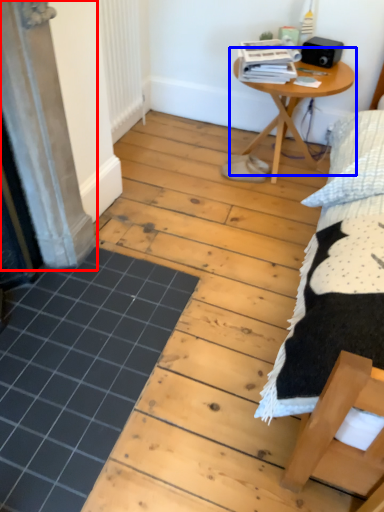
Question: Which object appears farthest to the camera in this image, screen door (highlighted by a red box) or table (highlighted by a blue box)?

Choices:
 (A) screen door
 (B) table

Answer: (B)